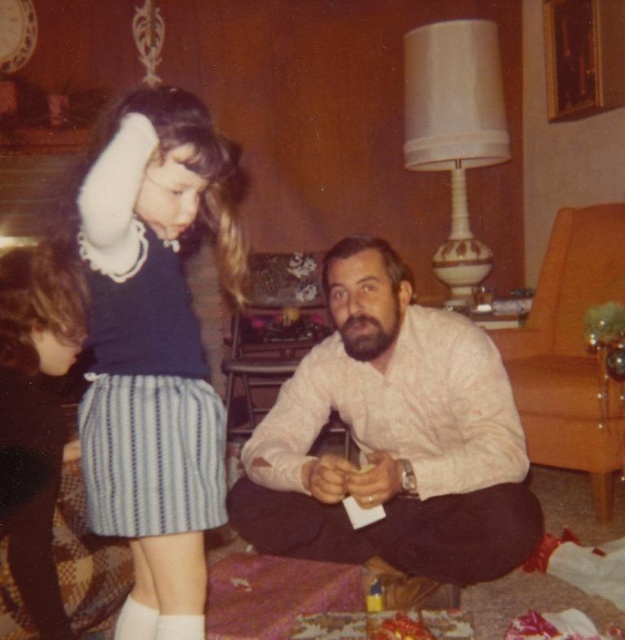
Question: Is white soft sweater at upper left wider than dark brown hair at lower left?

Choices:
 (A) no
 (B) yes

Answer: (B)

Question: Which point is farther to the camera?

Choices:
 (A) orange fabric armchair at right
 (B) white soft sock at lower left
 (C) white soft sweater at upper left
 (D) dark brown hair at lower left

Answer: (A)

Question: Which of the following is the closest to the observer?

Choices:
 (A) (136, 449)
 (B) (161, 628)
 (C) (398, 355)

Answer: (A)

Question: Which of the following is the closest to the observer?

Choices:
 (A) orange fabric armchair at right
 (B) dark brown hair at lower left

Answer: (B)

Question: Can you confirm if white soft sweater at upper left is positioned below dark brown hair at lower left?

Choices:
 (A) no
 (B) yes

Answer: (A)

Question: Is white textured shirt at center to the left of white soft sock at lower left from the viewer's perspective?

Choices:
 (A) yes
 (B) no

Answer: (B)